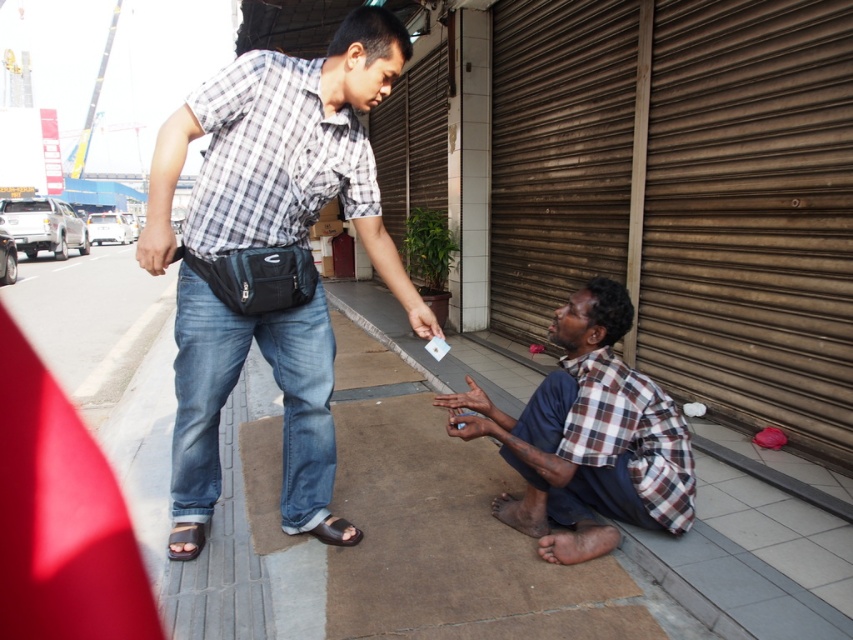
Question: Does brown corrugated metal at lower right appear over brown leather sandal at lower center?

Choices:
 (A) no
 (B) yes

Answer: (B)

Question: In this image, where is plaid cotton shirt at center located relative to brown leather sandal at lower center?

Choices:
 (A) below
 (B) above

Answer: (B)

Question: Does brown corrugated metal at lower right have a larger size compared to brown leather sandal at lower left?

Choices:
 (A) yes
 (B) no

Answer: (A)

Question: Which is farther from the brown checkered shirt at lower center?

Choices:
 (A) brown leather sandal at lower left
 (B) brown leather sandal at lower center
 (C) brown corrugated metal at lower right
 (D) plaid cotton shirt at center

Answer: (C)

Question: Which point is closer to the camera?

Choices:
 (A) (357, 44)
 (B) (621, 272)
 (C) (440, 396)

Answer: (A)

Question: Which is nearer to the brown corrugated metal at lower right?

Choices:
 (A) brown checkered shirt at lower center
 (B) plaid cotton shirt at center

Answer: (A)